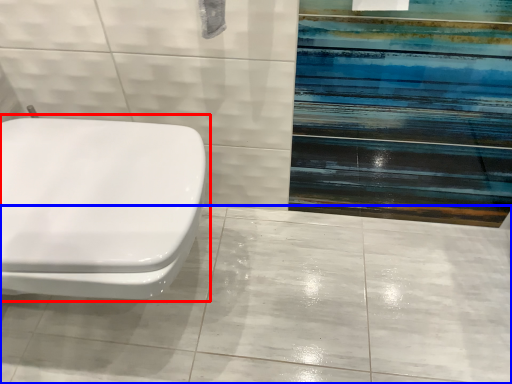
Question: Which object appears closest to the camera in this image, toilet (highlighted by a red box) or ceramic tile (highlighted by a blue box)?

Choices:
 (A) toilet
 (B) ceramic tile

Answer: (A)